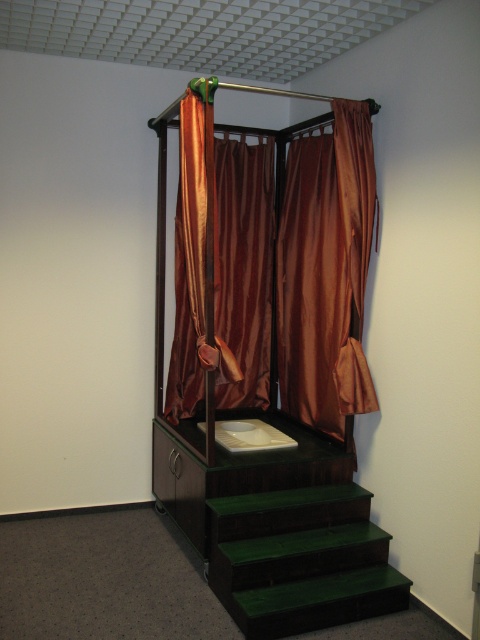
You are standing in the bathroom and want to reach the sink on the elevated platform. There is a satin brown curtain at center blocking your path. Can you walk around it to access the sink area?

The satin brown curtain at center is 3.02 meters away from viewer, so yes, you can walk around it to access the sink area since it is positioned at a distance allowing for maneuvering space.